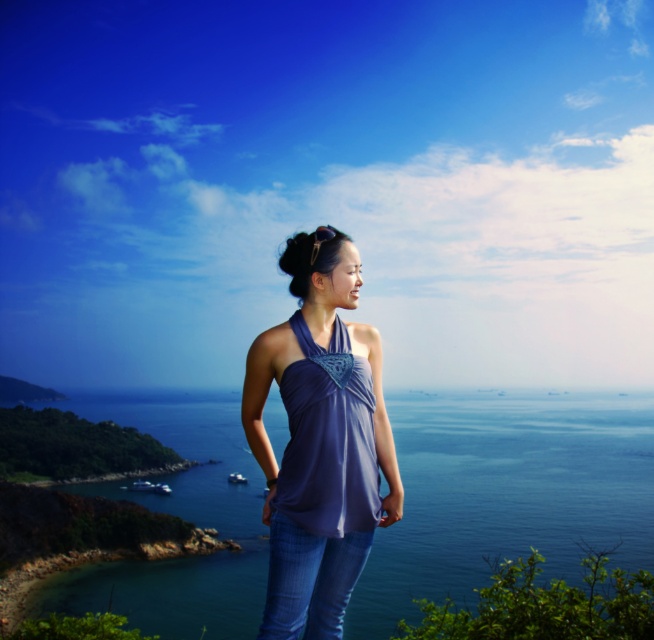
You are a photographer trying to capture the woman in the coastal scene. You notice the purple fabric top at center and the blue denim jeans at center. Which part of her outfit will appear closer to the camera in the photo?

The purple fabric top at center will appear closer to the camera because it is further to the viewer than the blue denim jeans at center.

You are standing at the center of the image and want to locate the blue water at center. According to the coordinates provided, in which direction should you look to find it?

The blue water at center is located at coordinates point [506,493], so you should look slightly downward and to the right from the exact center to find it.